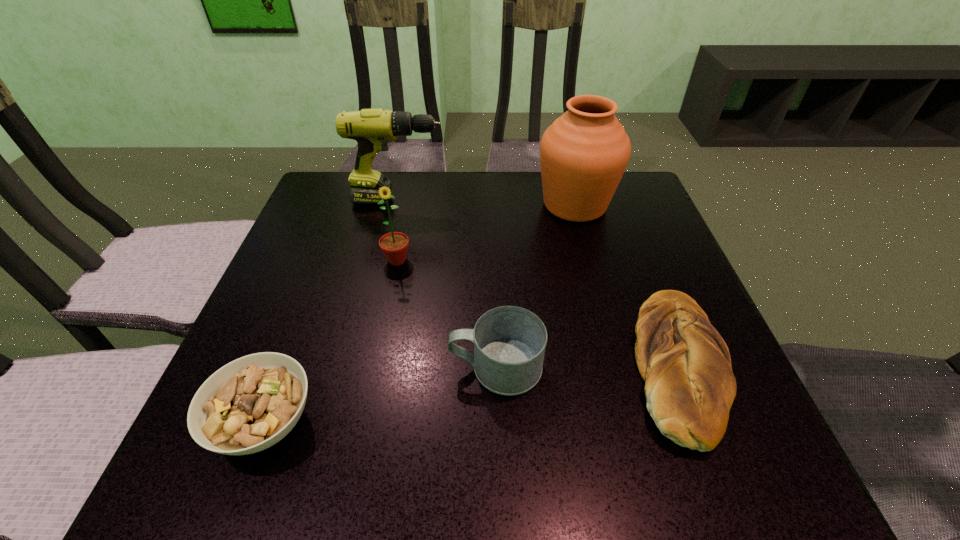
This screenshot has height=540, width=960. Find the location of `vacant region that satisfies the following two spatial constraints: 1. on the back side of the stew; 2. on the left side of the urn`. vacant region that satisfies the following two spatial constraints: 1. on the back side of the stew; 2. on the left side of the urn is located at coordinates (347, 205).

In order to click on free spot that satisfies the following two spatial constraints: 1. on the handle side of the urn; 2. on the right side of the drill in this screenshot , I will do `click(397, 205)`.